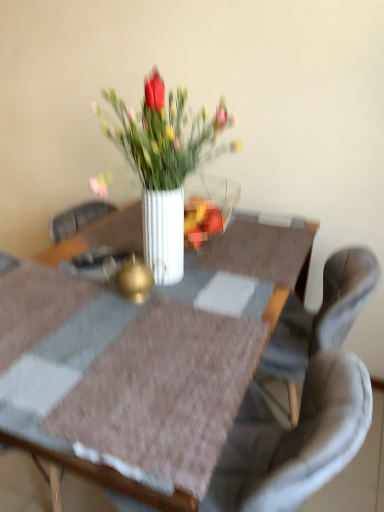
Find the location of `vacant area that is situated to the right of white glossy vase at center`. vacant area that is situated to the right of white glossy vase at center is located at coordinates (256, 247).